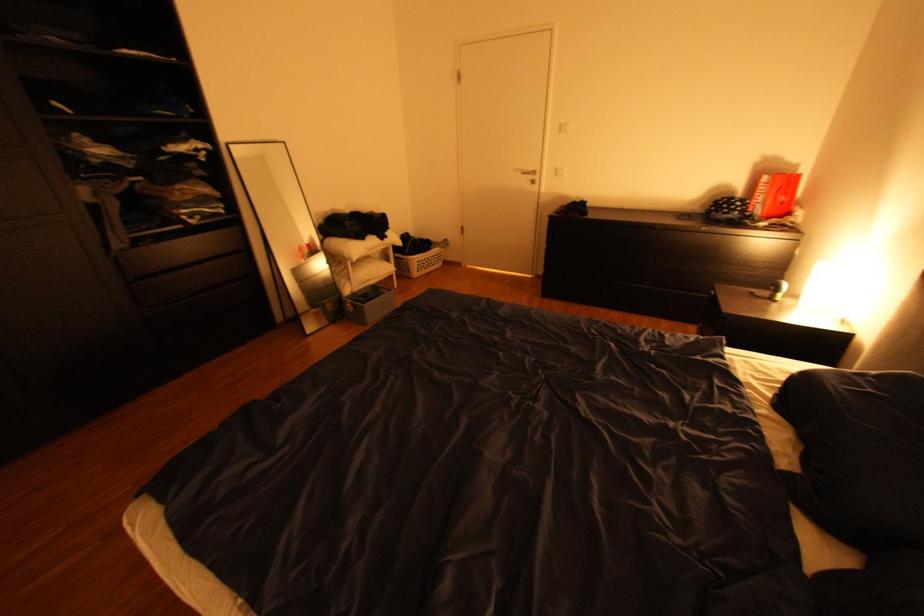
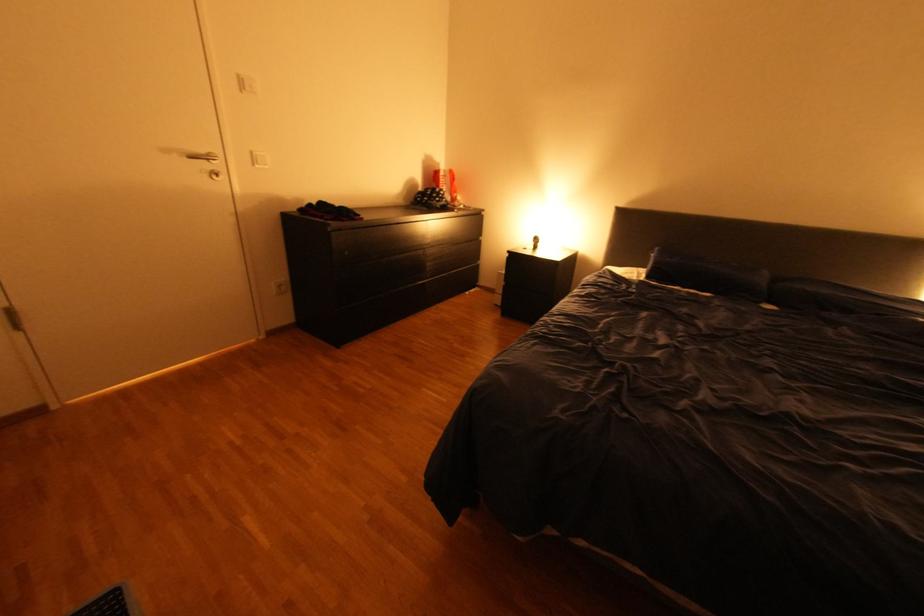
In the second image, find the point that corresponds to (541,169) in the first image.

(213, 151)